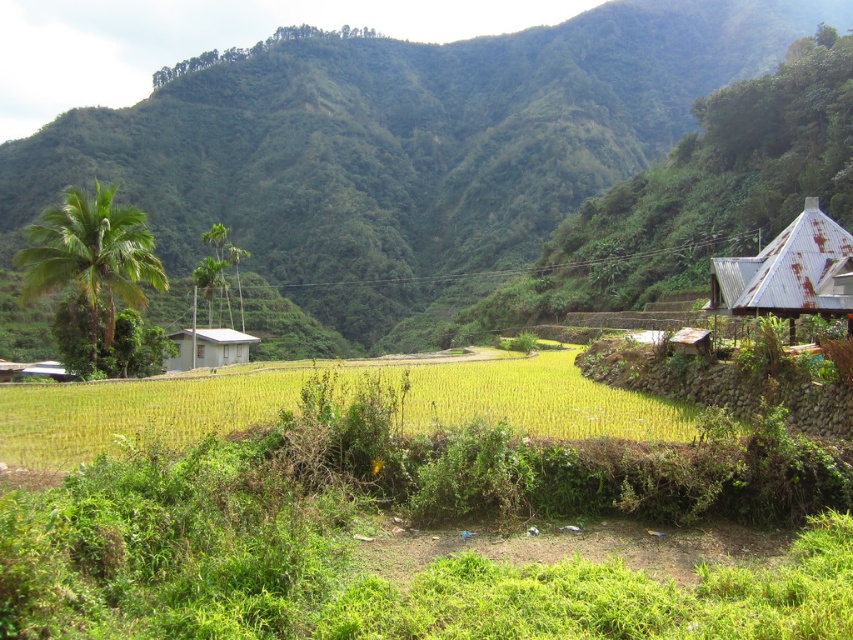
Identify the location of green leafy mountain at upper center. (404, 148).

Is green leafy mountain at upper center above white corrugated metal hut at center?

Yes, green leafy mountain at upper center is above white corrugated metal hut at center.

Where is `green leafy mountain at upper center`? green leafy mountain at upper center is located at coordinates (404, 148).

This screenshot has width=853, height=640. Identify the location of green leafy mountain at upper center. (404, 148).

In the scene shown: Between green leafy mountain at upper center and rusty metal hut at right, which one is positioned higher?

green leafy mountain at upper center

Is green leafy mountain at upper center smaller than rusty metal hut at right?

No.

Is point (521, 196) behind point (753, 304)?

Yes.

I want to click on green leafy mountain at upper center, so click(404, 148).

Which is in front, point (453, 67) or point (0, 442)?

Point (0, 442) is more forward.

Who is positioned more to the left, green leafy mountain at upper center or yellow-green grass at center?

From the viewer's perspective, green leafy mountain at upper center appears more on the left side.

Where is `green leafy mountain at upper center`? green leafy mountain at upper center is located at coordinates (404, 148).

This screenshot has width=853, height=640. Find the location of `green leafy mountain at upper center`. green leafy mountain at upper center is located at coordinates (404, 148).